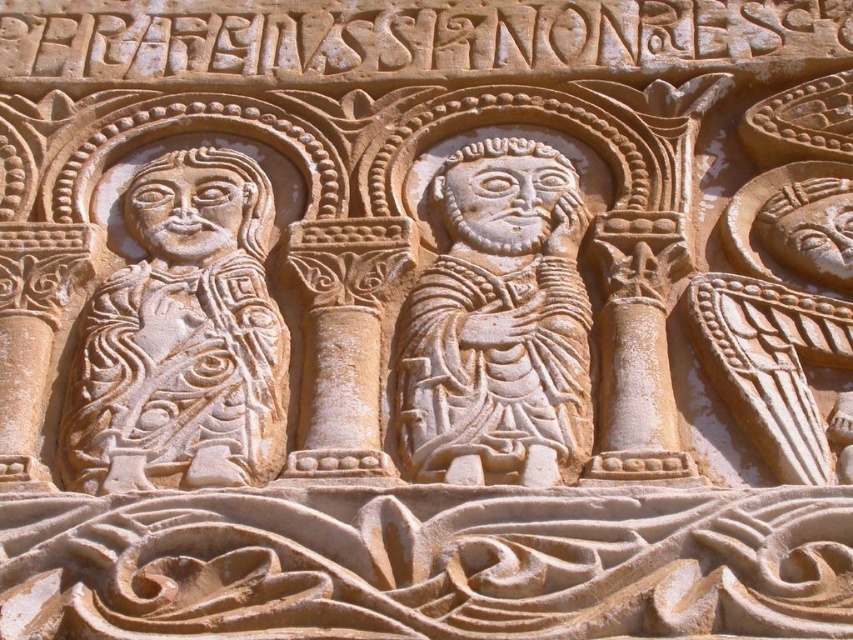
Question: Does light beige stone figure at left appear on the right side of white stone figure at center?

Choices:
 (A) no
 (B) yes

Answer: (A)

Question: Which of the following is the farthest from the observer?

Choices:
 (A) (531, 284)
 (B) (74, 442)

Answer: (A)

Question: Does light beige stone figure at left have a greater width compared to white stone figure at center?

Choices:
 (A) no
 (B) yes

Answer: (B)

Question: Which point is farther to the camera?

Choices:
 (A) white stone figure at center
 (B) light beige stone figure at left

Answer: (B)

Question: Which point appears farthest from the camera in this image?

Choices:
 (A) (415, 356)
 (B) (257, 184)

Answer: (B)

Question: Does light beige stone figure at left lie behind white stone figure at center?

Choices:
 (A) yes
 (B) no

Answer: (A)